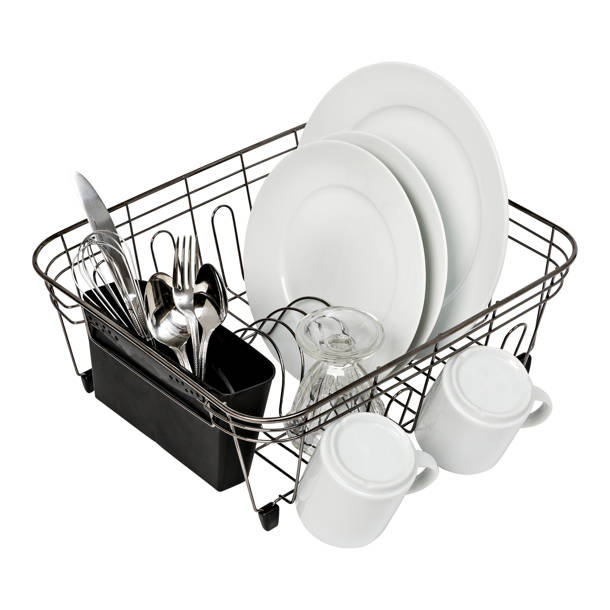
Locate an element on the screen. This screenshot has height=610, width=610. drying rack is located at coordinates pos(174,432), pos(559,271).